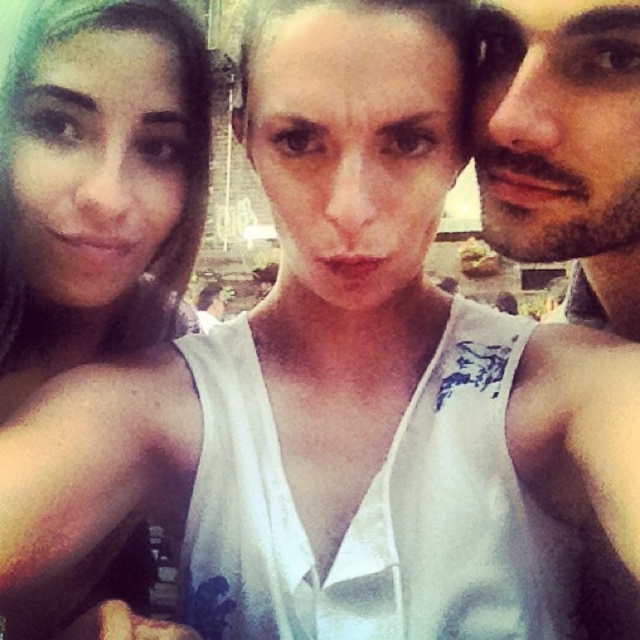
You are trying to locate the white fabric tank top at upper left in the image. According to the coordinates provided, where exactly is it positioned?

The white fabric tank top at upper left is located at point 0.291 on the x axis and 0.155 on the y axis.

In the scene shown: You are taking a selfie with two friends. You notice the shiny white tank top at right and the matte skin face at left in the frame. Which object is located to the right side of the other?

The shiny white tank top at right is positioned on the right side of matte skin face at left.